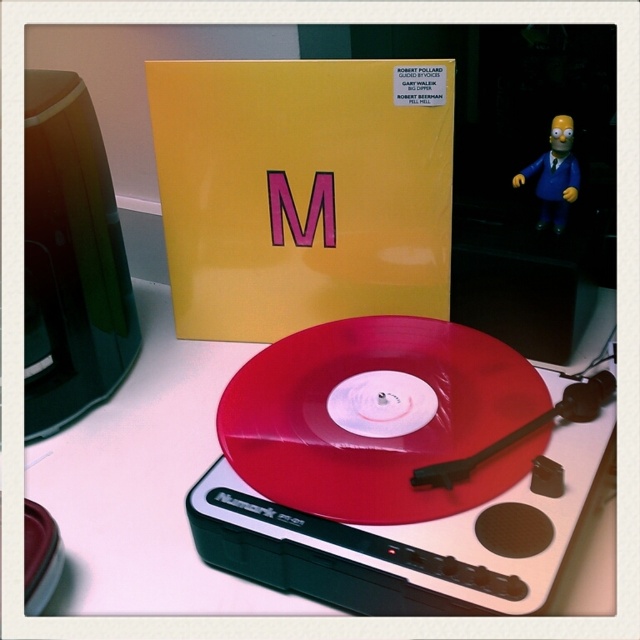
Question: Is the position of white plastic turntable at center less distant than that of blue plastic homer simpson figurine at upper right?

Choices:
 (A) no
 (B) yes

Answer: (B)

Question: Where is white plastic turntable at center located in relation to blue plastic homer simpson figurine at upper right in the image?

Choices:
 (A) right
 (B) left

Answer: (B)

Question: Does white plastic turntable at center have a larger size compared to blue plastic homer simpson figurine at upper right?

Choices:
 (A) yes
 (B) no

Answer: (A)

Question: Which point is farther to the camera?

Choices:
 (A) (99, 416)
 (B) (563, 145)

Answer: (A)